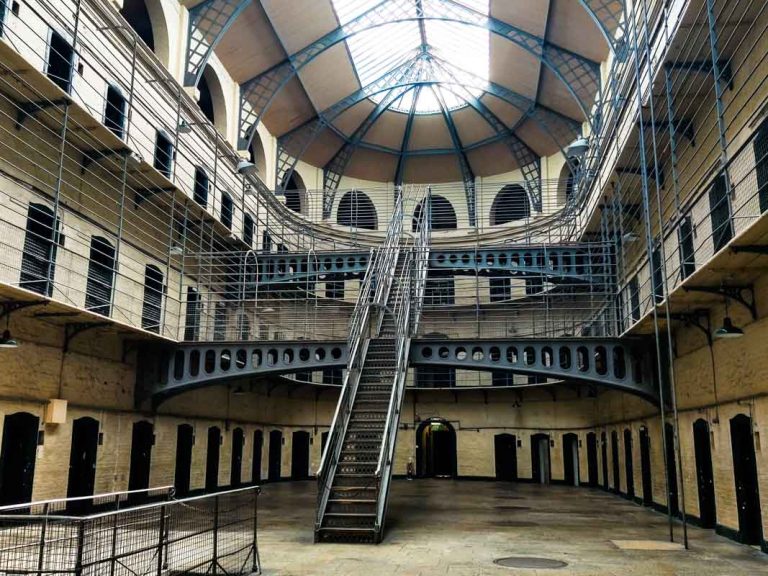
The image size is (768, 576). Find the location of `skylight`. skylight is located at coordinates (384, 49), (461, 45), (352, 6), (428, 101).